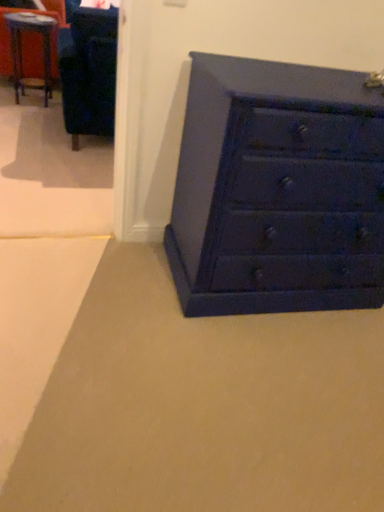
Question: Does matte blue chest of drawers at lower right turn towards velvet blue armchair at upper left?

Choices:
 (A) yes
 (B) no

Answer: (B)

Question: Are matte blue chest of drawers at lower right and velvet blue armchair at upper left located far from each other?

Choices:
 (A) yes
 (B) no

Answer: (A)

Question: Are matte blue chest of drawers at lower right and velvet blue armchair at upper left making contact?

Choices:
 (A) yes
 (B) no

Answer: (B)

Question: Does matte blue chest of drawers at lower right have a greater height compared to velvet blue armchair at upper left?

Choices:
 (A) no
 (B) yes

Answer: (B)

Question: Is matte blue chest of drawers at lower right surrounding velvet blue armchair at upper left?

Choices:
 (A) no
 (B) yes

Answer: (A)

Question: From a real-world perspective, is matte blue chest of drawers at lower right on top of velvet blue armchair at upper left?

Choices:
 (A) no
 (B) yes

Answer: (B)

Question: From the image's perspective, is velvet blue armchair at upper left beneath metallic blue table at upper left?

Choices:
 (A) no
 (B) yes

Answer: (B)

Question: Can you confirm if velvet blue armchair at upper left is smaller than metallic blue table at upper left?

Choices:
 (A) no
 (B) yes

Answer: (A)

Question: Is velvet blue armchair at upper left positioned far away from metallic blue table at upper left?

Choices:
 (A) no
 (B) yes

Answer: (B)

Question: Can you confirm if velvet blue armchair at upper left is positioned to the right of metallic blue table at upper left?

Choices:
 (A) yes
 (B) no

Answer: (A)

Question: Is velvet blue armchair at upper left beside metallic blue table at upper left?

Choices:
 (A) no
 (B) yes

Answer: (A)

Question: Is velvet blue armchair at upper left looking in the opposite direction of metallic blue table at upper left?

Choices:
 (A) no
 (B) yes

Answer: (A)

Question: Is metallic blue table at upper left surrounding velvet blue armchair at upper left?

Choices:
 (A) yes
 (B) no

Answer: (B)